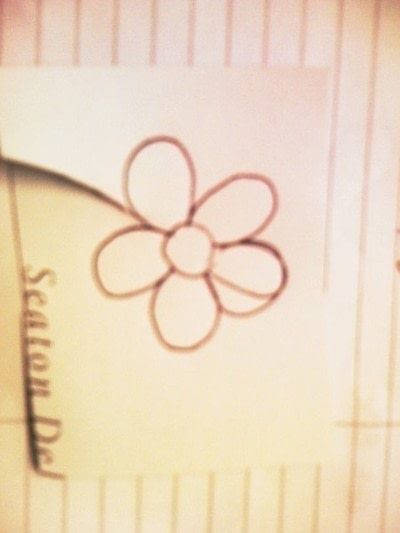
The height and width of the screenshot is (533, 400). Identify the location of note paper behind paper with drawing. (164, 42).